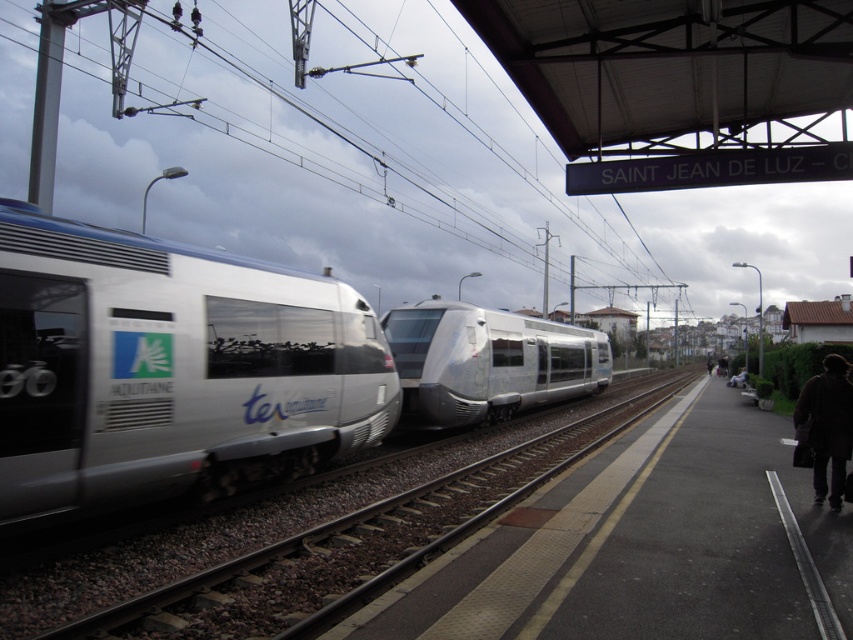
Between point (100, 353) and point (381, 320), which one is positioned behind?

Positioned behind is point (381, 320).

Can you confirm if silver metallic train at left is shorter than silver metallic bullet train at center?

Indeed, silver metallic train at left has a lesser height compared to silver metallic bullet train at center.

Find the location of a particular element. Image resolution: width=853 pixels, height=640 pixels. silver metallic train at left is located at coordinates (171, 369).

Locate an element on the screen. silver metallic train at left is located at coordinates (171, 369).

Measure the distance from silver metallic train at left to silver metallic train track at center.

They are 9.13 meters apart.

Is point (363, 312) positioned before point (207, 609)?

No, it is not.

Is point (213, 324) less distant than point (657, 403)?

Yes, it is in front of point (657, 403).

Where is `silver metallic train at left`? silver metallic train at left is located at coordinates (171, 369).

Is silver metallic train track at center shorter than silver metallic bullet train at center?

Correct, silver metallic train track at center is not as tall as silver metallic bullet train at center.

Between silver metallic train track at center and silver metallic bullet train at center, which one is positioned lower?

silver metallic train track at center is lower down.

Between point (509, 449) and point (583, 353), which one is positioned in front?

Point (509, 449) is in front.

Where is `silver metallic train track at center`? silver metallic train track at center is located at coordinates pyautogui.click(x=355, y=545).